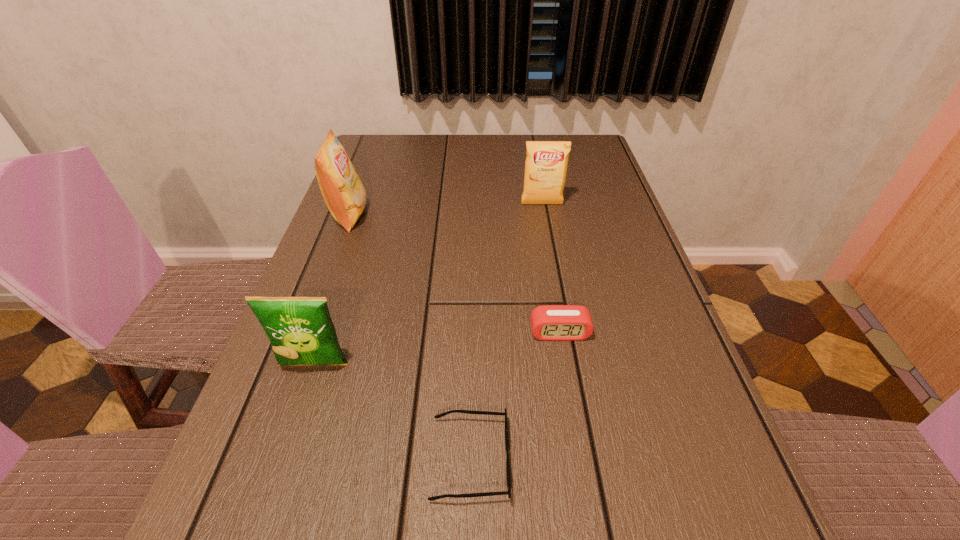
Locate an element on the screen. object situated at the right edge is located at coordinates (546, 164).

At what (x,y) coordinates should I click in order to perform the action: click on vacant area at the far edge of the desktop. Please return your answer as a coordinate pair (x, y). The image size is (960, 540). Looking at the image, I should click on (469, 135).

Find the location of a particular element. The image size is (960, 540). free region at the left edge of the desktop is located at coordinates pyautogui.click(x=364, y=221).

In the image, there is a desktop. Where is `vacant space at the right edge`? vacant space at the right edge is located at coordinates (587, 247).

The width and height of the screenshot is (960, 540). In the image, there is a desktop. In order to click on vacant space at the far left corner in this screenshot , I will do `click(373, 144)`.

Where is `free space at the far right corner of the desktop`? free space at the far right corner of the desktop is located at coordinates (587, 162).

Where is `free area in between the second nearest object and the sunglasses`? free area in between the second nearest object and the sunglasses is located at coordinates (392, 412).

Find the location of a particular element. Image resolution: width=960 pixels, height=540 pixels. vacant area that lies between the second nearest object and the third object from right to left is located at coordinates (392, 412).

The width and height of the screenshot is (960, 540). I want to click on vacant space that's between the rightmost crisp (potato chip) and the second nearest object, so click(x=428, y=285).

You are a GUI agent. You are given a task and a screenshot of the screen. Output one action in this format:
    pyautogui.click(x=<x>, y=<y>)
    Task: Click on the empty space that is in between the second shortest object and the third object from left to right
    The height and width of the screenshot is (540, 960).
    Given the screenshot: What is the action you would take?
    pyautogui.click(x=515, y=396)